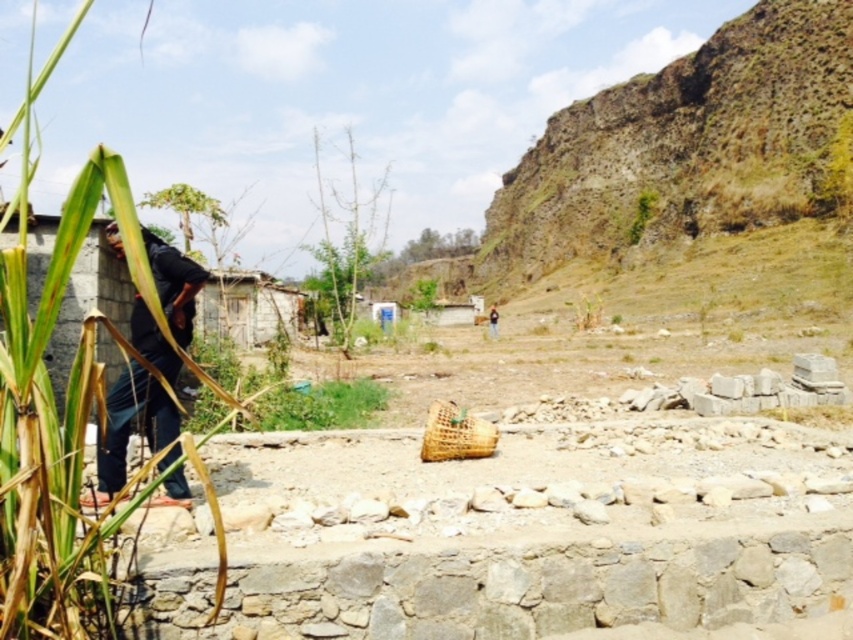
Question: Which point is farther from the camera taking this photo?

Choices:
 (A) (488, 321)
 (B) (316, 387)
 (C) (466, 454)

Answer: (A)

Question: Considering the relative positions of green grass at center and woven bamboo basket at center in the image provided, where is green grass at center located with respect to woven bamboo basket at center?

Choices:
 (A) below
 (B) above

Answer: (B)

Question: Which of the following is the closest to the observer?

Choices:
 (A) green grass at center
 (B) brown leather jacket at center
 (C) woven bamboo basket at center
 (D) green leafy reed at left

Answer: (D)

Question: Is dark blue jeans at left bigger than green grass at center?

Choices:
 (A) yes
 (B) no

Answer: (A)

Question: Based on their relative distances, which object is nearer to the woven bamboo basket at center?

Choices:
 (A) green grass at center
 (B) green leafy reed at left
 (C) dark blue jeans at left
 (D) brown leather jacket at center

Answer: (C)

Question: Is dark blue jeans at left smaller than woven bamboo basket at center?

Choices:
 (A) no
 (B) yes

Answer: (A)